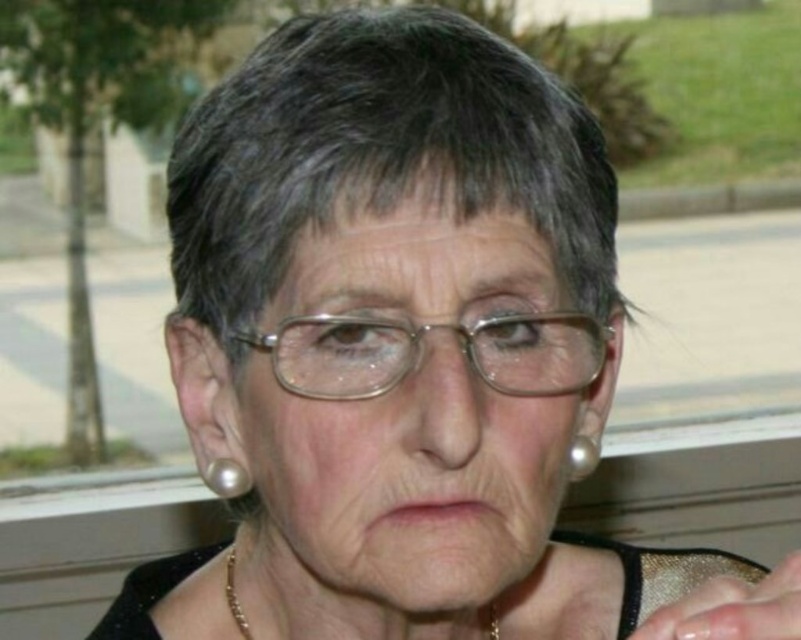
You are a photographer adjusting your camera settings to capture the gold chain at lower center and the pearlelegantearring at upper right. Based on their sizes in the frame, which object should you focus on first if you want both to be in sharp focus?

The gold chain at lower center has a greater height compared to pearlelegantearring at upper right, so you should focus on the gold chain at lower center first to ensure both are in sharp focus.

Where is the clear plastic glasses at center located in the image?

The clear plastic glasses at center is located at point [419,353].